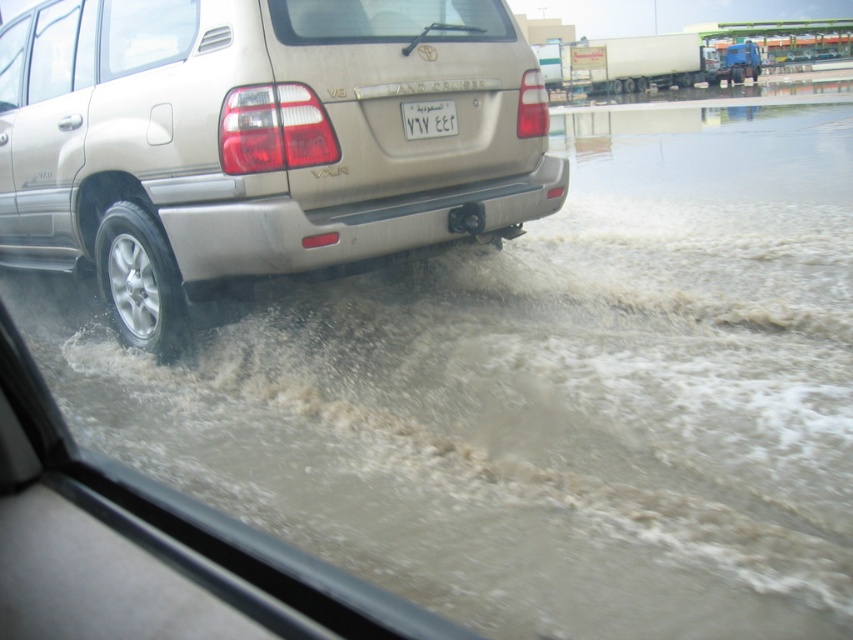
Question: Is satin beige suv at center smaller than white plastic license plate at center?

Choices:
 (A) no
 (B) yes

Answer: (A)

Question: Which object appears closest to the camera in this image?

Choices:
 (A) white plastic license plate at center
 (B) satin beige suv at center

Answer: (B)

Question: Which point appears farthest from the camera in this image?

Choices:
 (A) (442, 115)
 (B) (398, 136)

Answer: (A)

Question: Is the position of satin beige suv at center more distant than that of white plastic license plate at center?

Choices:
 (A) no
 (B) yes

Answer: (A)

Question: Does satin beige suv at center have a greater width compared to white plastic license plate at center?

Choices:
 (A) no
 (B) yes

Answer: (B)